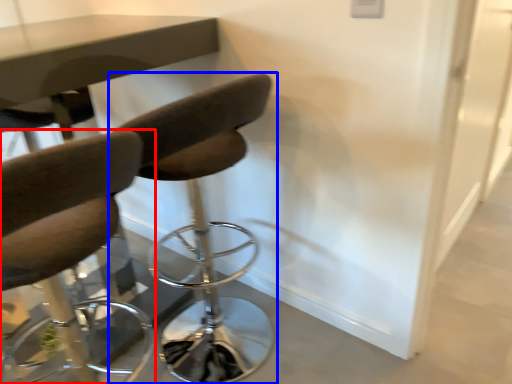
Question: Which of the following is the closest to the observer, chair (highlighted by a red box) or chair (highlighted by a blue box)?

Choices:
 (A) chair
 (B) chair

Answer: (A)